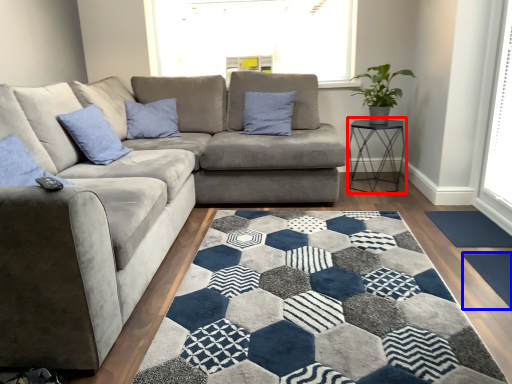
Question: Which object is further to the camera taking this photo, table (highlighted by a red box) or doormat (highlighted by a blue box)?

Choices:
 (A) table
 (B) doormat

Answer: (A)